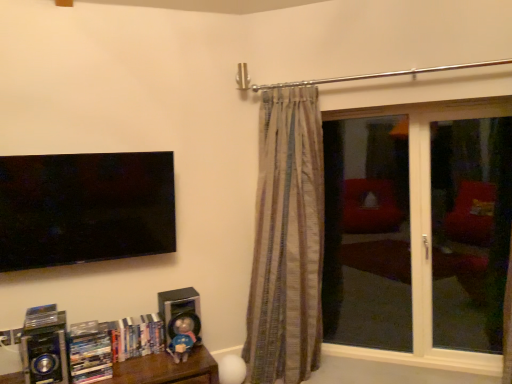
Question: Can you confirm if metallic blue speaker at lower left, which is the 1th speaker from front to back, is positioned to the left of metallic silver stereo at lower left?

Choices:
 (A) yes
 (B) no

Answer: (A)

Question: Is metallic blue speaker at lower left, which is the 1th speaker from front to back, thinner than metallic silver stereo at lower left?

Choices:
 (A) yes
 (B) no

Answer: (A)

Question: Does metallic blue speaker at lower left, which is the 1th speaker from front to back, appear on the right side of metallic silver stereo at lower left?

Choices:
 (A) yes
 (B) no

Answer: (B)

Question: Is metallic blue speaker at lower left, arranged as the 2th speaker when viewed from the back, placed right next to metallic silver stereo at lower left?

Choices:
 (A) yes
 (B) no

Answer: (B)

Question: Are metallic blue speaker at lower left, which is the 2th speaker from right to left, and metallic silver stereo at lower left located far from each other?

Choices:
 (A) yes
 (B) no

Answer: (B)

Question: Would you say metallic blue speaker at lower left, which is the 2th speaker from right to left, is to the left or to the right of transparent glass screen door at right, which is the 2th screen door from right to left, in the picture?

Choices:
 (A) right
 (B) left

Answer: (B)

Question: Which is correct: metallic blue speaker at lower left, which is the 1th speaker from front to back, is inside transparent glass screen door at right, the 1th screen door when ordered from left to right, or outside of it?

Choices:
 (A) outside
 (B) inside

Answer: (A)

Question: Does point (28, 369) appear closer or farther from the camera than point (392, 185)?

Choices:
 (A) farther
 (B) closer

Answer: (B)

Question: From the image's perspective, is metallic blue speaker at lower left, which appears as the first speaker when viewed from the left, located above or below transparent glass screen door at right, which is the 2th screen door from right to left?

Choices:
 (A) below
 (B) above

Answer: (A)

Question: Is metallic silver stereo at lower left wider or thinner than metallic blue speaker at lower left, which is the 1th speaker from front to back?

Choices:
 (A) thin
 (B) wide

Answer: (B)

Question: From a real-world perspective, relative to metallic blue speaker at lower left, which appears as the first speaker when viewed from the left, is metallic silver stereo at lower left vertically above or below?

Choices:
 (A) below
 (B) above

Answer: (A)

Question: Choose the correct answer: Is metallic silver stereo at lower left inside metallic blue speaker at lower left, which is the 2th speaker from right to left, or outside it?

Choices:
 (A) inside
 (B) outside

Answer: (B)

Question: Based on their sizes in the image, would you say metallic silver stereo at lower left is bigger or smaller than metallic blue speaker at lower left, arranged as the 2th speaker when viewed from the back?

Choices:
 (A) big
 (B) small

Answer: (A)

Question: Is transparent glass window at right inside the boundaries of silver metallic speaker at lower center, the 2th speaker in the left-to-right sequence, or outside?

Choices:
 (A) outside
 (B) inside

Answer: (A)

Question: Relative to silver metallic speaker at lower center, the 2th speaker in the left-to-right sequence, is transparent glass window at right in front or behind?

Choices:
 (A) front
 (B) behind

Answer: (B)